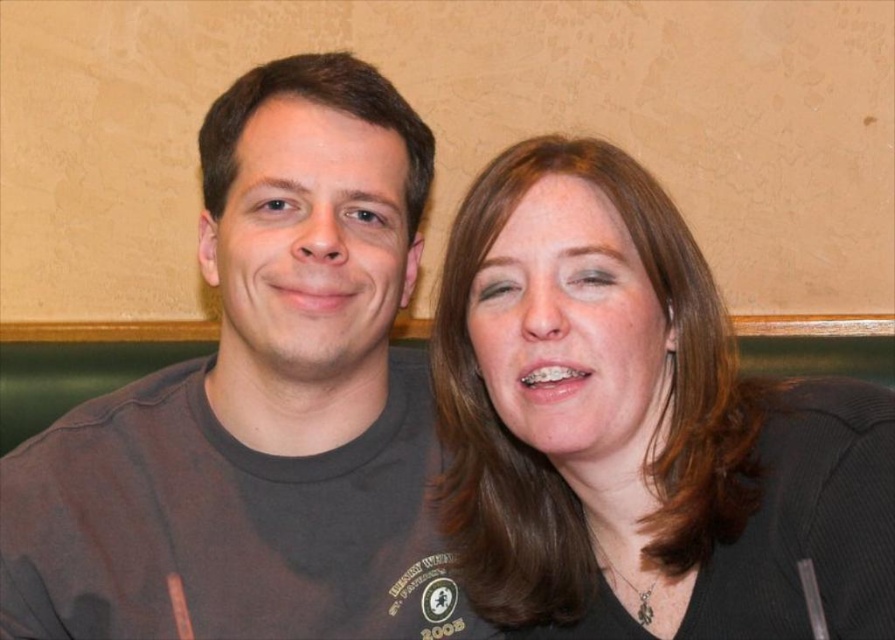
You are standing in front of the beige wall where the two people are sitting. There is a point marked at coordinates (260, 404). Which object from the scene is located at this point?

The point at (260, 404) corresponds to the dark gray t shirt at left.